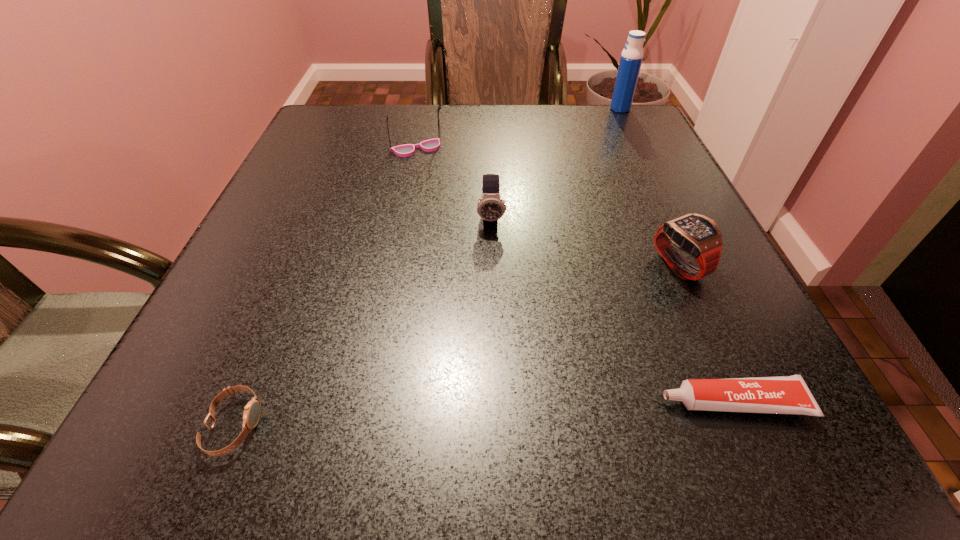
Find the location of a particular element. This screenshot has height=540, width=960. the shortest watch is located at coordinates (252, 411).

At what (x,y) coordinates should I click in order to perform the action: click on vacant space positioned 0.320m on the front of the water bottle. Please return your answer as a coordinate pair (x, y). The height and width of the screenshot is (540, 960). Looking at the image, I should click on (656, 181).

The height and width of the screenshot is (540, 960). In order to click on free space located 0.120m on the left of the spectacles in this screenshot , I will do `click(340, 149)`.

This screenshot has width=960, height=540. In order to click on vacant space situated 0.220m on the face of the fourth nearest object in this screenshot , I will do `click(493, 323)`.

Image resolution: width=960 pixels, height=540 pixels. In order to click on free space located 0.280m on the front of the second farthest watch in this screenshot , I will do `click(765, 458)`.

Identify the location of vacant region located 0.390m at the nozzle of the toothpaste. [371, 402].

Where is `vacant region located at the nozzle of the toothpaste`? Image resolution: width=960 pixels, height=540 pixels. vacant region located at the nozzle of the toothpaste is located at coordinates (371, 402).

Locate an element on the screen. The height and width of the screenshot is (540, 960). vacant space located at the nozzle of the toothpaste is located at coordinates (x=624, y=402).

Find the location of a particular element. Image resolution: width=960 pixels, height=540 pixels. vacant space located on the face of the shortest watch is located at coordinates (545, 426).

In order to click on water bottle that is at the far edge in this screenshot , I will do `click(631, 58)`.